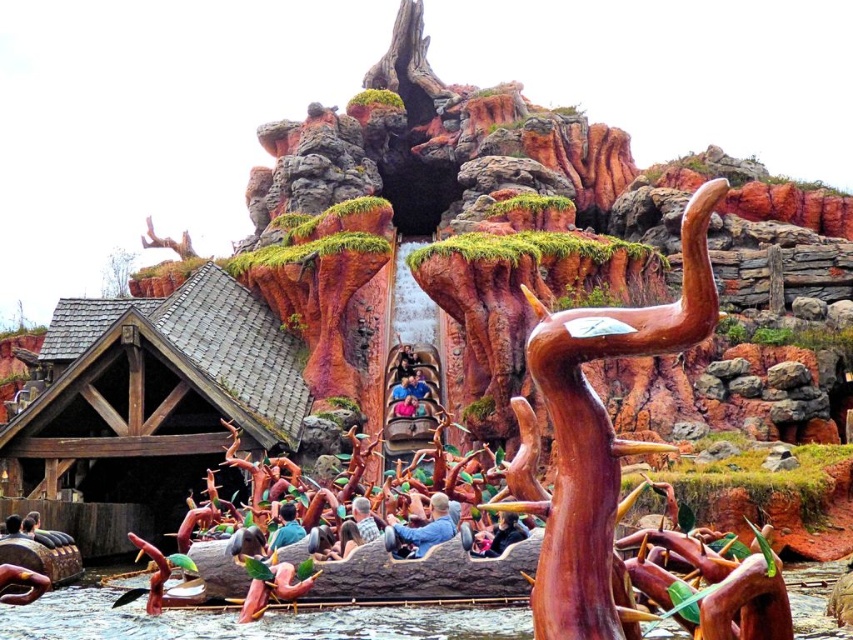
Question: Which point appears farthest from the camera in this image?

Choices:
 (A) (657, 536)
 (B) (4, 570)
 (C) (273, 540)
 (D) (125, 285)

Answer: (D)

Question: Estimate the real-world distances between objects in this image. Which object is closer to the brown wood sculpture at upper center?

Choices:
 (A) dark blue shirt at center
 (B) green mossy tree at upper left
 (C) wooden figure at center
 (D) blue denim jacket at center

Answer: (D)

Question: Does brown wood sculpture at upper center appear over wooden figure at center?

Choices:
 (A) yes
 (B) no

Answer: (A)

Question: Which object is positioned closest to the blue denim jacket at center?

Choices:
 (A) brown wood sculpture at upper center
 (B) wooden figure at center
 (C) dark blue shirt at center

Answer: (C)

Question: Is green mossy tree at upper left further to the viewer compared to dark blue shirt at center?

Choices:
 (A) no
 (B) yes

Answer: (B)

Question: Is blue denim jacket at center positioned in front of wooden figure at center?

Choices:
 (A) no
 (B) yes

Answer: (A)